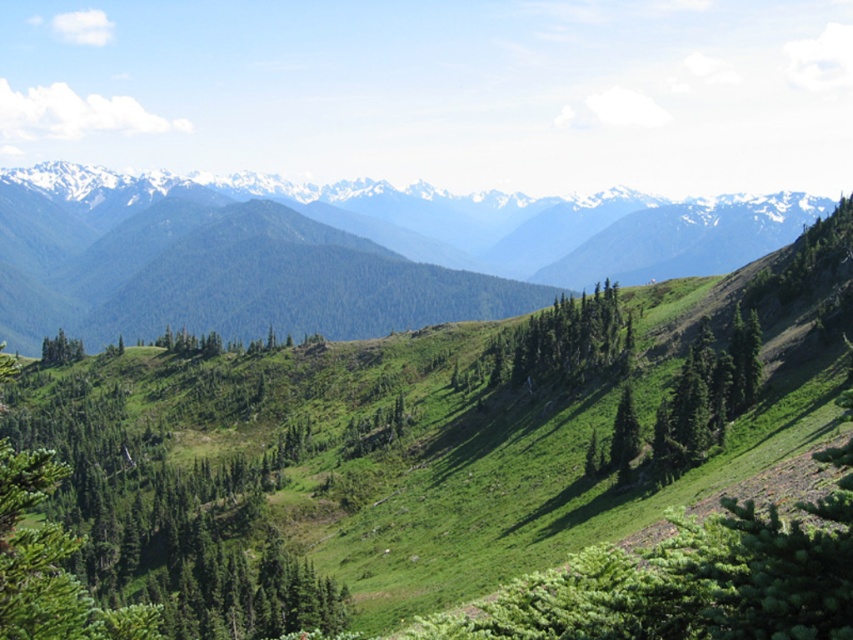
You are a hiker planning to take a photo of the green matte tree at center and the green matte tree at lower left. Which tree should you stand closer to in order to capture both in a single frame?

You should stand closer to the green matte tree at lower left because it is shorter than the green matte tree at center, allowing both trees to be included in the frame when positioned appropriately.

You are standing at the point marked as point [347,246] in the image. What is the name of the terrain feature directly beneath your feet?

The green grassy hillside at center is located at point [347,246], so the terrain feature directly beneath your feet is the green grassy hillside at center.

Based on the scene description, can you determine which object is wider between the green grassy hillside at center and the green leafy tree at center?

The green grassy hillside at center is wider than the green leafy tree at center according to the description.